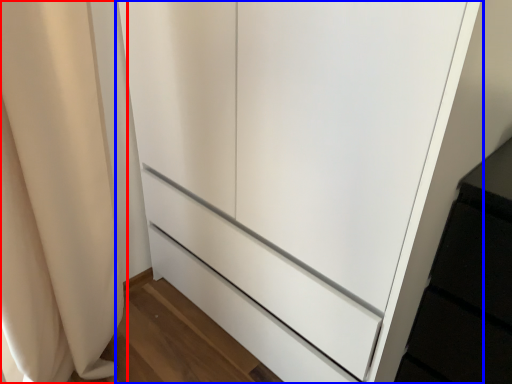
Question: Among these objects, which one is nearest to the camera, curtain (highlighted by a red box) or cupboard (highlighted by a blue box)?

Choices:
 (A) curtain
 (B) cupboard

Answer: (B)